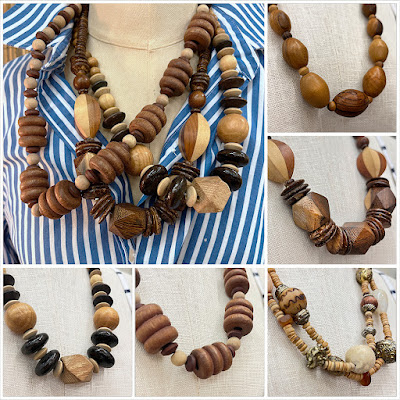
At what (x,y) coordinates should I click in order to perform the action: click on large square picture. Please return your answer as a coordinate pair (x, y). Looking at the image, I should click on (140, 94).